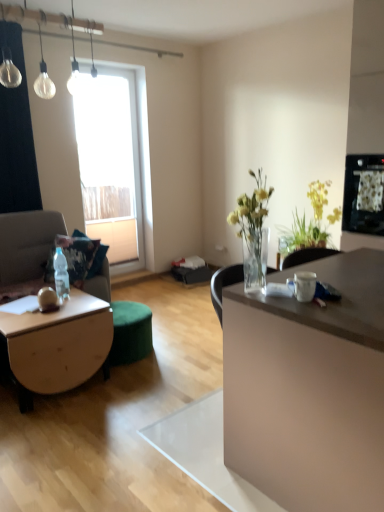
The width and height of the screenshot is (384, 512). Identify the location of vacant area that is in front of wooden coffee table at lower left. (54, 431).